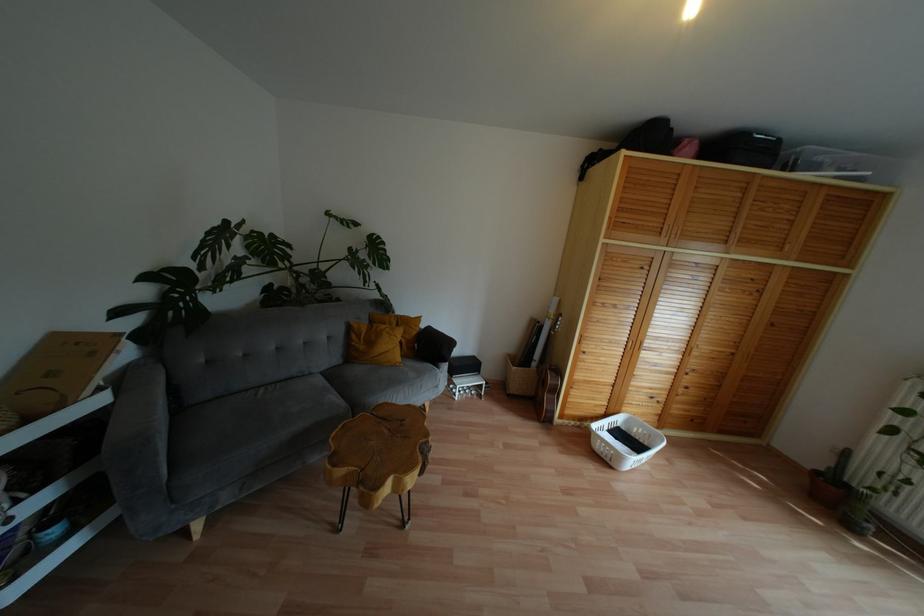
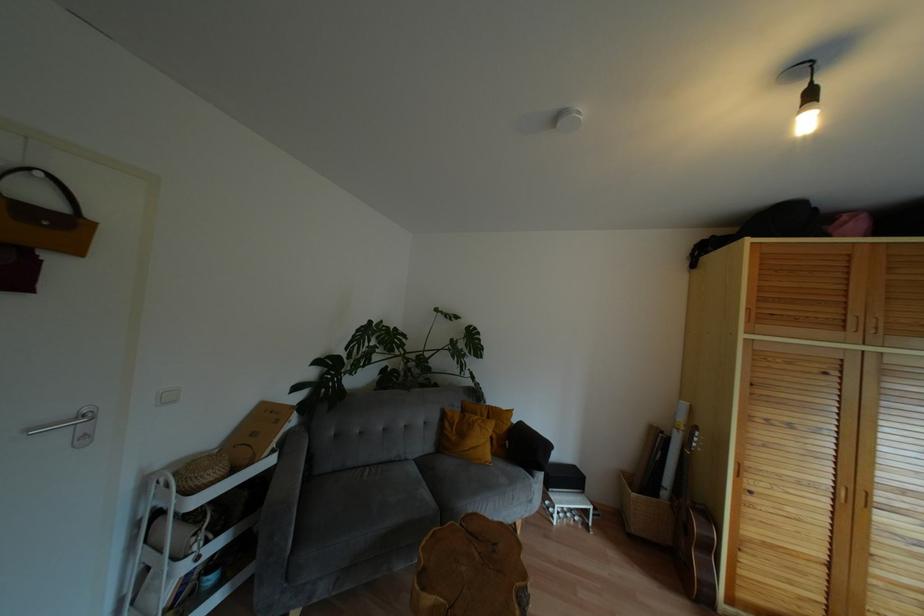
Find the pixel in the second image that matches pixel 640 342 in the first image.

(867, 493)